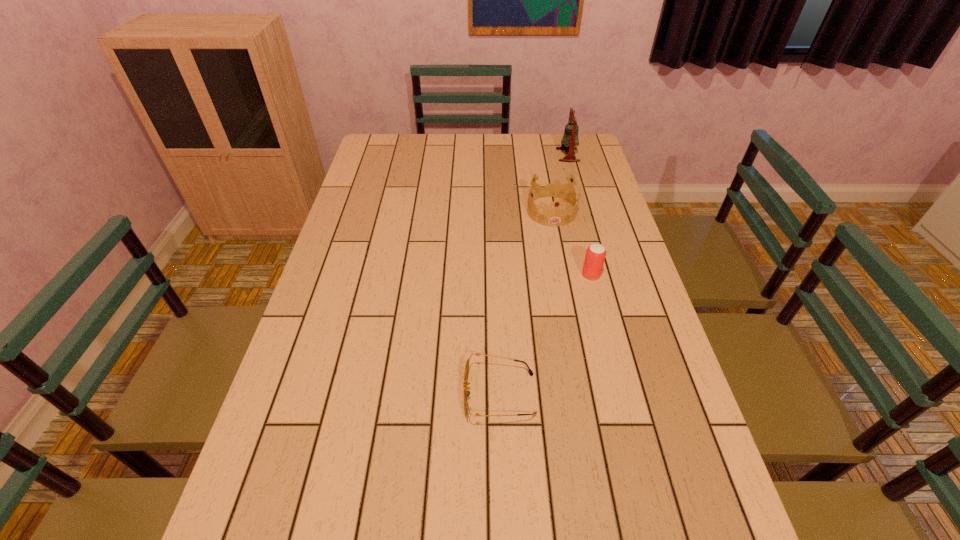
The width and height of the screenshot is (960, 540). What are the coordinates of `the tallest object` in the screenshot? It's located at (570, 138).

You are a GUI agent. You are given a task and a screenshot of the screen. Output one action in this format:
    pyautogui.click(x=<x>, y=<y>)
    Task: Click on the bell
    This screenshot has width=960, height=540.
    Given the screenshot: What is the action you would take?
    pyautogui.click(x=570, y=138)

This screenshot has width=960, height=540. Identify the location of tiara. (556, 216).

This screenshot has height=540, width=960. In order to click on beer can in this screenshot , I will do `click(595, 256)`.

Where is `the shortest object`? the shortest object is located at coordinates (466, 393).

You are a GUI agent. You are given a task and a screenshot of the screen. Output one action in this format:
    pyautogui.click(x=<x>, y=<y>)
    Task: Click on the nearest object
    The image size is (960, 540).
    Given the screenshot: What is the action you would take?
    pyautogui.click(x=466, y=393)

You are a GUI agent. You are given a task and a screenshot of the screen. Output one action in this format:
    pyautogui.click(x=<x>, y=<y>)
    Task: Click on the vacant area located on the left of the tallest object
    The width and height of the screenshot is (960, 540).
    Given the screenshot: What is the action you would take?
    pyautogui.click(x=483, y=155)

Identify the location of vacant area situated 0.160m on the front-facing side of the tiara. The width and height of the screenshot is (960, 540). (561, 261).

Find the location of a particular element. The height and width of the screenshot is (540, 960). free space located on the front of the third farthest object is located at coordinates (612, 356).

You are a GUI agent. You are given a task and a screenshot of the screen. Output one action in this format:
    pyautogui.click(x=<x>, y=<y>)
    Task: Click on the free location located 0.350m on the lenses of the leftmost object
    
    Given the screenshot: What is the action you would take?
    pyautogui.click(x=305, y=394)